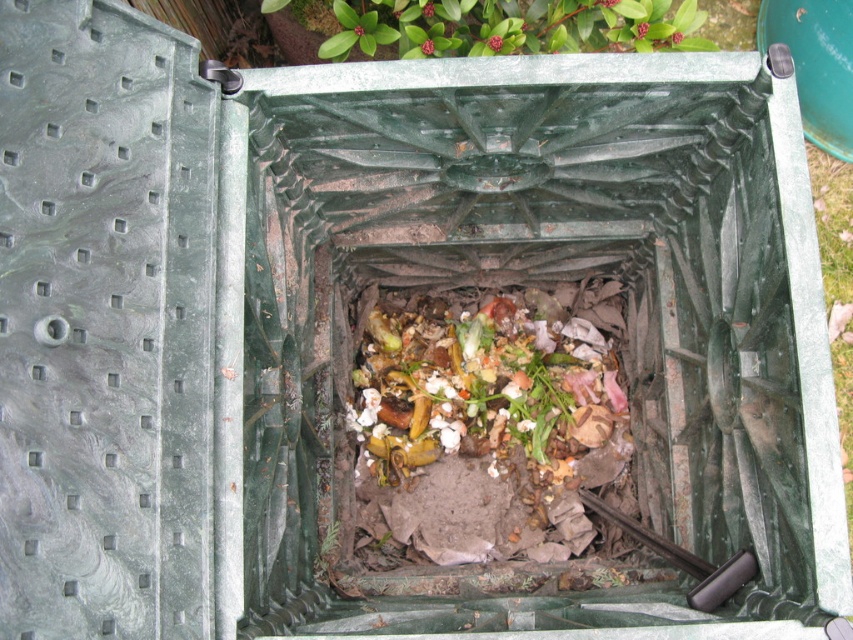
You are standing in front of the compost bin and want to check the contents. Which object is closer to you, the brown crumbly food at center or the green leafy plant at upper center?

The brown crumbly food at center is closer to you than the green leafy plant at upper center because it is further to the viewer.

You are a gardener who needs to place a new plant in the compost bin. The plant you have is 4 feet tall. Considering the space between the brown crumbly food at center and the green leafy plant at upper center, will the new plant fit vertically in the compost bin?

The distance between the brown crumbly food at center and the green leafy plant at upper center is 3.86 feet. Since the new plant is 4 feet tall, it will not fit vertically in the compost bin as it is slightly taller than the available space.